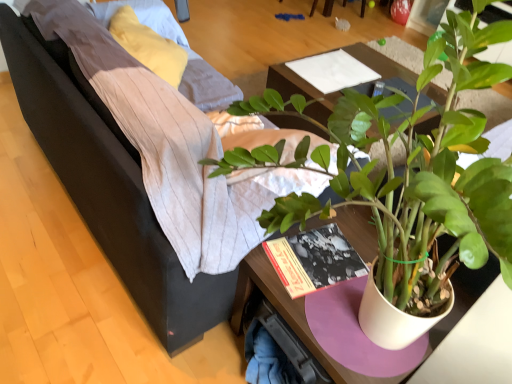
Question: Does green matte plant at center have a greater height compared to wooden table at center?

Choices:
 (A) no
 (B) yes

Answer: (B)

Question: Can you confirm if green matte plant at center is positioned to the right of wooden table at center?

Choices:
 (A) yes
 (B) no

Answer: (B)

Question: From a real-world perspective, is green matte plant at center below wooden table at center?

Choices:
 (A) no
 (B) yes

Answer: (A)

Question: Is the depth of green matte plant at center less than that of wooden table at center?

Choices:
 (A) no
 (B) yes

Answer: (B)

Question: Can you confirm if green matte plant at center is positioned to the left of wooden table at center?

Choices:
 (A) no
 (B) yes

Answer: (B)

Question: Considering the positions of dark gray fabric couch at center and wooden table at center in the image, is dark gray fabric couch at center wider or thinner than wooden table at center?

Choices:
 (A) thin
 (B) wide

Answer: (B)

Question: From the image's perspective, is dark gray fabric couch at center above or below wooden table at center?

Choices:
 (A) below
 (B) above

Answer: (A)

Question: Is point (110, 230) closer or farther from the camera than point (410, 76)?

Choices:
 (A) farther
 (B) closer

Answer: (B)

Question: Is dark gray fabric couch at center spatially inside wooden table at center, or outside of it?

Choices:
 (A) outside
 (B) inside

Answer: (A)

Question: From a real-world perspective, is green matte plant at center positioned above or below wooden table at center?

Choices:
 (A) above
 (B) below

Answer: (A)

Question: From the image's perspective, is green matte plant at center positioned above or below wooden table at center?

Choices:
 (A) above
 (B) below

Answer: (B)

Question: Considering the positions of point (384, 223) and point (439, 97), is point (384, 223) closer or farther from the camera than point (439, 97)?

Choices:
 (A) farther
 (B) closer

Answer: (A)

Question: Which is correct: green matte plant at center is inside wooden table at center, or outside of it?

Choices:
 (A) outside
 (B) inside

Answer: (A)

Question: Is point (268, 148) positioned closer to the camera than point (99, 122)?

Choices:
 (A) farther
 (B) closer

Answer: (B)

Question: Visually, is green matte plant at center positioned to the left or to the right of dark gray fabric couch at center?

Choices:
 (A) left
 (B) right

Answer: (B)